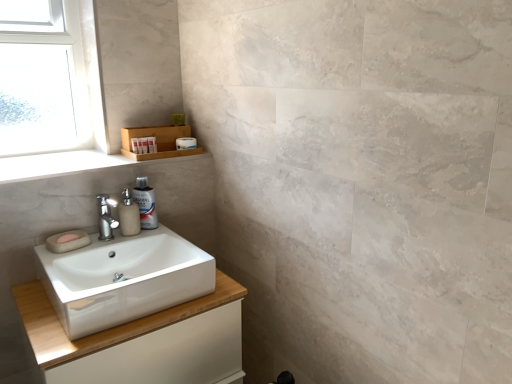
Question: From their relative heights in the image, would you say white glossy sink at lower left is taller or shorter than white matte container at upper left, which is counted as the second toiletry, starting from the back?

Choices:
 (A) tall
 (B) short

Answer: (A)

Question: Is white glossy sink at lower left wider or thinner than white matte container at upper left, marked as the 1th toiletry in a left-to-right arrangement?

Choices:
 (A) wide
 (B) thin

Answer: (A)

Question: Which object is positioned farthest from the beige matte soap dispenser at center?

Choices:
 (A) clear glass window at upper left
 (B) white matte toilet paper at upper center
 (C) white glossy sink at lower left
 (D) translucent plastic spray bottle at sink
 (E) wooden shelf at upper left

Answer: (A)

Question: Considering the real-world distances, which object is closest to the white glossy sink at lower left?

Choices:
 (A) translucent plastic spray bottle at sink
 (B) white glossy cabinet at lower left
 (C) beige matte soap dispenser at center
 (D) white matte toilet paper at upper center
 (E) white matte container at upper left, marked as the 1th toiletry in a left-to-right arrangement

Answer: (B)